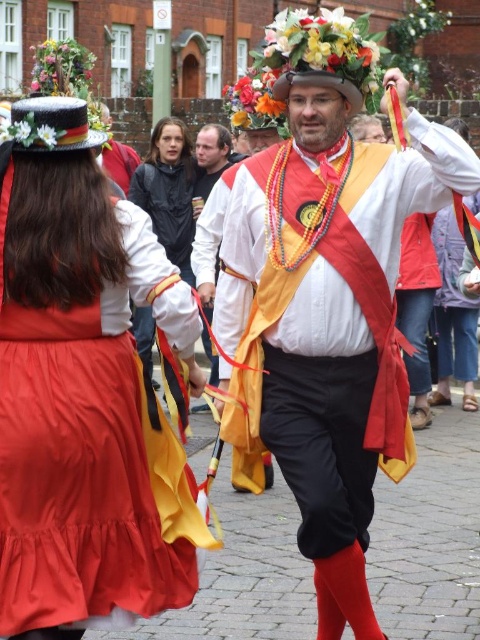
Consider the image. Can you confirm if matte black hat at upper left is thinner than matte white robe at center?

Incorrect, matte black hat at upper left's width is not less than matte white robe at center's.

Which is in front, point (17, 163) or point (194, 257)?

Point (17, 163) is more forward.

Where is `matte black hat at upper left`? matte black hat at upper left is located at coordinates (85, 394).

Is matte white shirt at center thinner than matte white robe at center?

In fact, matte white shirt at center might be wider than matte white robe at center.

Between point (368, 72) and point (208, 257), which one is positioned in front?

Point (368, 72)

Who is more distant from viewer, (x=233, y=211) or (x=207, y=145)?

The point (x=207, y=145) is behind.

I want to click on matte white shirt at center, so [324, 298].

Based on the photo, who is more distant from viewer, (312, 168) or (25, 195)?

Positioned behind is point (312, 168).

Does matte white shirt at center lie behind matte black hat at upper left?

Yes.

Which is behind, point (304, 154) or point (12, 179)?

Positioned behind is point (304, 154).

What are the coordinates of `matte white shirt at center` in the screenshot? It's located at (324, 298).